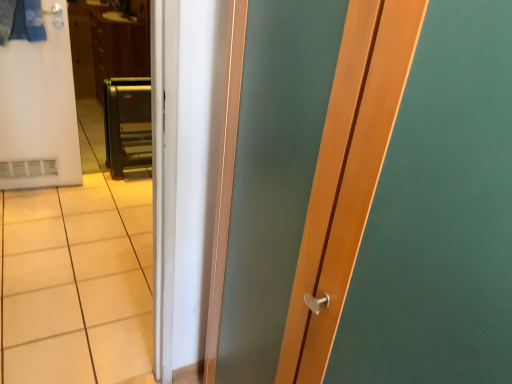
Where is `free space in front of metallic gray step ladder at center`? This screenshot has width=512, height=384. free space in front of metallic gray step ladder at center is located at coordinates click(x=122, y=190).